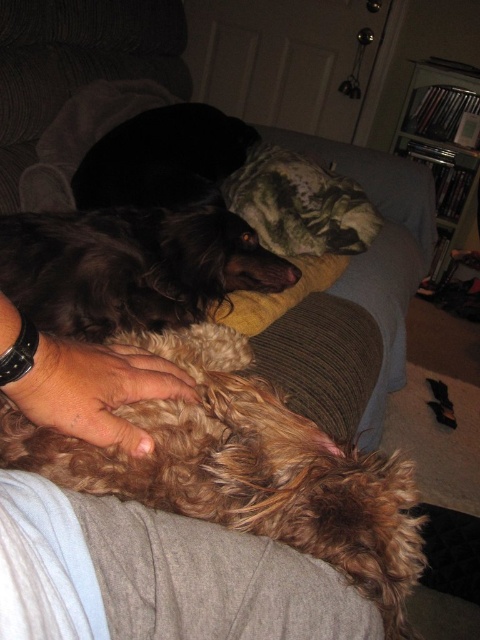
Question: Estimate the real-world distances between objects in this image. Which object is closer to the brown curly fur dog at center?

Choices:
 (A) brown furry dog at center
 (B) brown fuzzy dog at upper center

Answer: (A)

Question: Does brown furry dog at center appear on the right side of brown fuzzy dog at upper center?

Choices:
 (A) no
 (B) yes

Answer: (B)

Question: Which object is positioned farthest from the brown furry dog at center?

Choices:
 (A) brown fuzzy dog at upper center
 (B) fuzzy brown fur at lower center

Answer: (A)

Question: Does brown furry dog at center appear under brown fuzzy dog at upper center?

Choices:
 (A) no
 (B) yes

Answer: (B)

Question: Which point is farther to the camera?

Choices:
 (A) [13, 397]
 (B) [192, 483]

Answer: (B)

Question: Can you confirm if brown furry dog at center is positioned to the right of fuzzy brown fur at lower center?

Choices:
 (A) yes
 (B) no

Answer: (A)